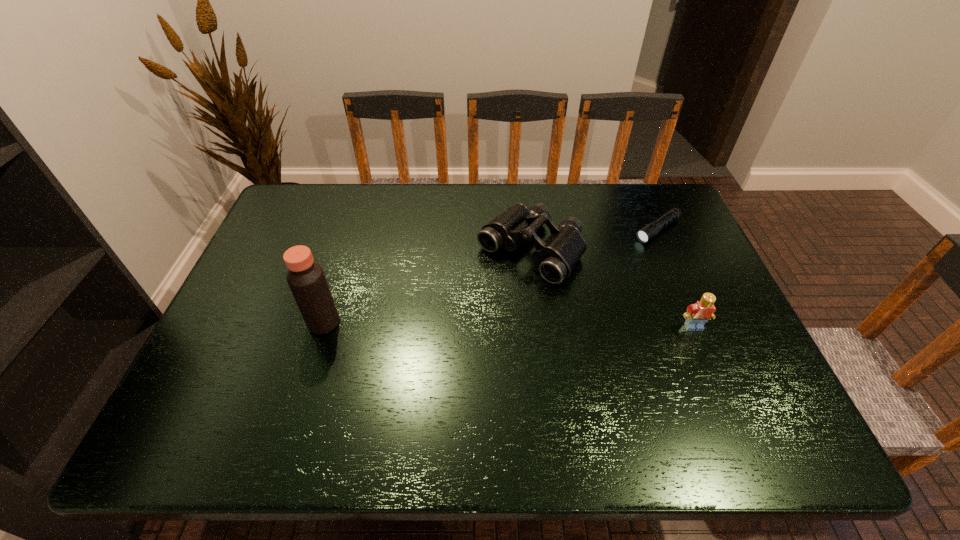
Locate an element on the screen. the tallest object is located at coordinates coord(306,279).

Locate an element on the screen. the leftmost object is located at coordinates (306, 279).

In order to click on Lego in this screenshot , I will do `click(697, 314)`.

You are a GUI agent. You are given a task and a screenshot of the screen. Output one action in this format:
    pyautogui.click(x=<x>, y=<y>)
    Task: Click on the flashlight
    This screenshot has width=960, height=540.
    Given the screenshot: What is the action you would take?
    (x=648, y=232)

Where is `binoculars`? binoculars is located at coordinates (556, 257).

This screenshot has width=960, height=540. I want to click on vacant position located 0.260m on the back of the tallest object, so click(x=348, y=243).

At what (x,y) coordinates should I click in order to perform the action: click on free point located on the front-facing side of the Lego. Please return your answer as a coordinate pair (x, y). The width and height of the screenshot is (960, 540). Looking at the image, I should click on (710, 366).

Identify the location of free point located 0.190m at the lens end of the shortest object. The width and height of the screenshot is (960, 540). (600, 269).

The width and height of the screenshot is (960, 540). In order to click on vacant space located at the lens end of the shortest object in this screenshot , I will do `click(551, 304)`.

I want to click on free space located 0.350m at the lens end of the shortest object, so click(x=562, y=296).